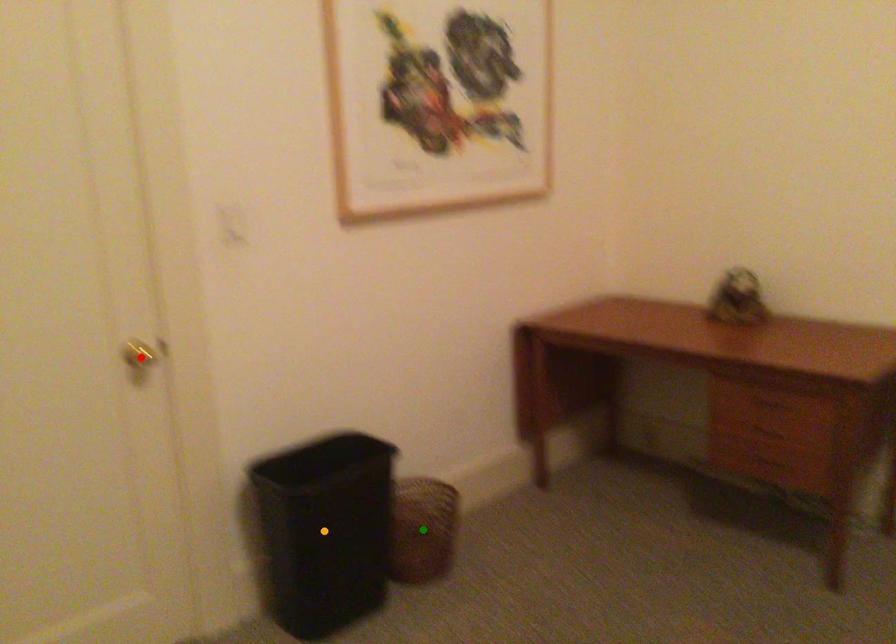
Order these from nearest to farthest:
A) red point
B) orange point
C) green point

red point, orange point, green point